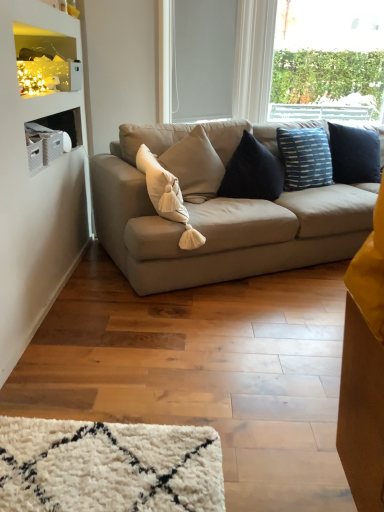
Question: In terms of width, does white matte window screen at upper center look wider or thinner when compared to beige fabric pillow at center?

Choices:
 (A) thin
 (B) wide

Answer: (A)

Question: From the image's perspective, is white matte window screen at upper center located above or below beige fabric pillow at center?

Choices:
 (A) below
 (B) above

Answer: (B)

Question: Estimate the real-world distances between objects in this image. Which object is closer to the white matte window screen at upper center?

Choices:
 (A) suede beige couch at center
 (B) transparent glass window at upper right
 (C) beige fabric pillow at center
 (D) matte white shelf at upper left

Answer: (A)

Question: Which of these objects is positioned farthest from the beige fabric pillow at center?

Choices:
 (A) matte white shelf at upper left
 (B) transparent glass window at upper right
 (C) suede beige couch at center
 (D) white matte window screen at upper center

Answer: (B)